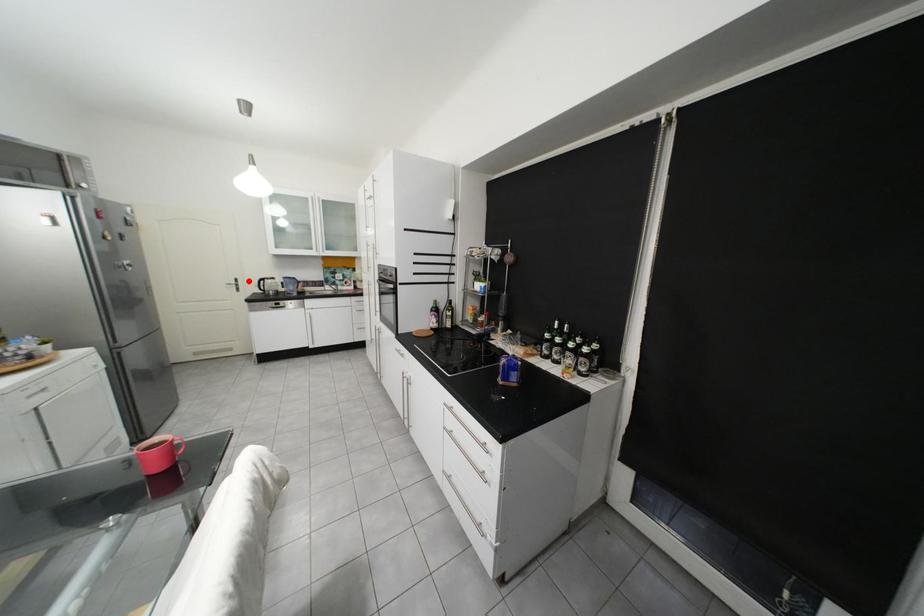
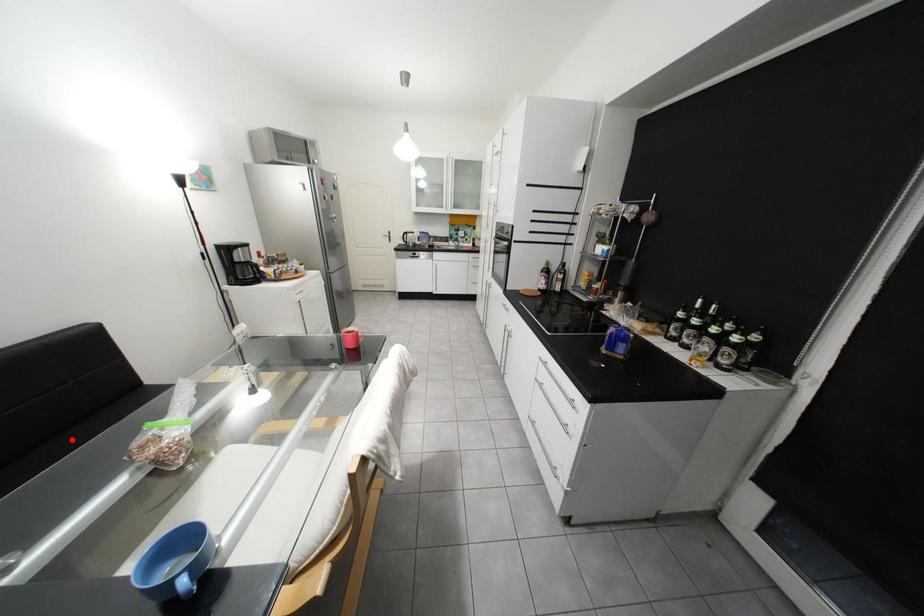
I am providing you with two images of the same scene from different viewpoints. A red point is marked on the first image and another point is marked on the second image. Is the red point in image1 aligned with the point shown in image2?

No